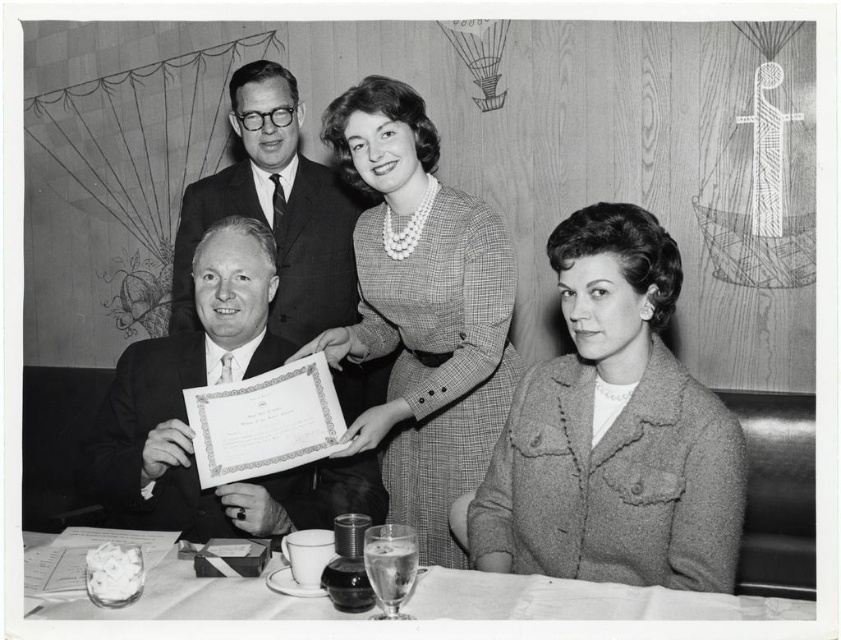
Question: Is smooth black suit at lower left wider than smooth glass table at lower center?

Choices:
 (A) yes
 (B) no

Answer: (B)

Question: Which object is farther from the camera taking this photo?

Choices:
 (A) smooth black suit at upper left
 (B) smooth glass table at lower center

Answer: (A)

Question: In this image, where is textured gray coat at lower right located relative to smooth black suit at lower left?

Choices:
 (A) right
 (B) left

Answer: (A)

Question: Which is nearer to the smooth black suit at lower left?

Choices:
 (A) smooth glass table at lower center
 (B) checkered fabric dress at upper center
 (C) textured gray coat at lower right
 (D) smooth black suit at upper left

Answer: (D)

Question: Estimate the real-world distances between objects in this image. Which object is closer to the textured gray coat at lower right?

Choices:
 (A) smooth black suit at lower left
 (B) smooth glass table at lower center

Answer: (B)

Question: Does textured gray coat at lower right appear over smooth glass table at lower center?

Choices:
 (A) no
 (B) yes

Answer: (B)